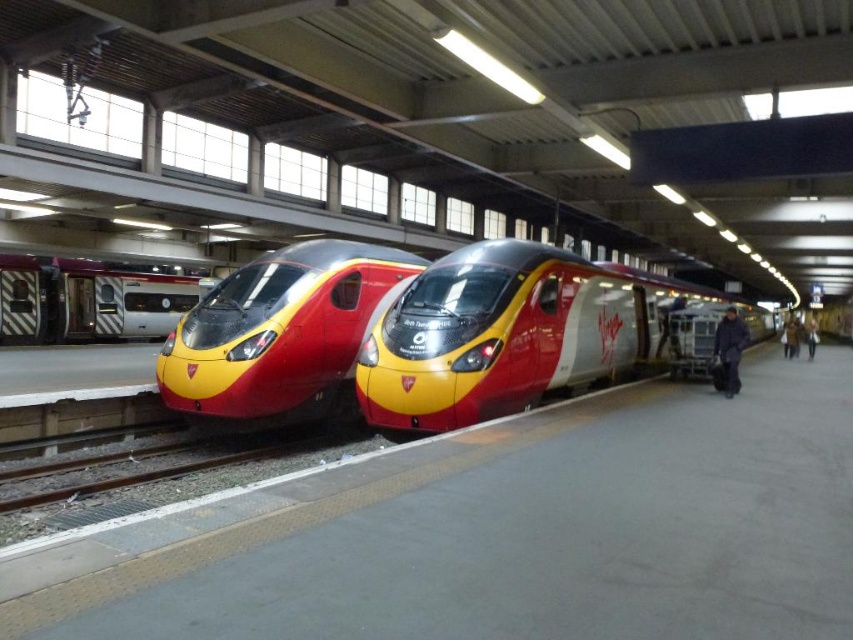
You are standing on the train platform and want to walk from point (x=473, y=369) to point (x=227, y=412). Which direction should you move to get closer to your destination?

You should move towards the lower right direction because point (x=473, y=369) is closer to the viewer than point (x=227, y=412), so moving lower and right will take you towards the destination.

You are standing at the train station platform and want to take a photo that includes both the point at coordinate (398, 253) and the point at coordinate (90, 314). Since the platform is quite long, you need to adjust your position to ensure both points are in frame. Considering their positions, which point will appear closer to the bottom edge of your camera view?

The point at coordinate (90, 314) will appear closer to the bottom edge of your camera view because it is farther from the camera compared to the point at (398, 253).